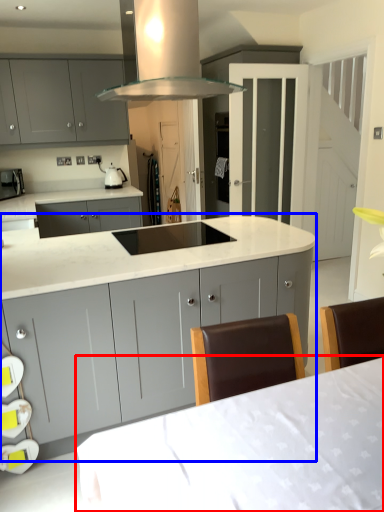
Question: Among these objects, which one is nearest to the camera, table (highlighted by a red box) or cabinetry (highlighted by a blue box)?

Choices:
 (A) table
 (B) cabinetry

Answer: (A)